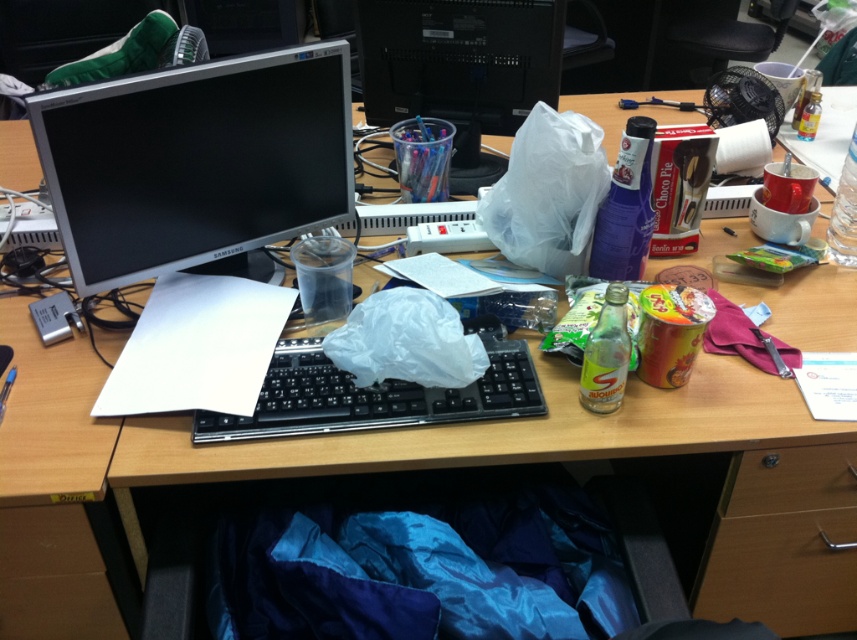
Consider the image. You are trying to place a tall plant next to the satin silver monitor at upper left and the transparent plastic cup at upper center. Which object should you place it next to if you want the plant to be taller than both?

You should place the tall plant next to the satin silver monitor at upper left because it is taller than the transparent plastic cup at upper center, so the plant can be positioned to be taller than both objects.

Looking at this image, you are organizing the desk and need to place a new item at the coordinates mentioned. Where exactly should you position the transparent plastic cup at upper center relative to the other items?

The transparent plastic cup at upper center should be positioned at the coordinates point (460,68) as specified in the description.

You are a delivery robot standing at the camera position. You need to place a package in the wooden drawer at lower center. Can you reach it without moving your position?

The wooden drawer at lower center is 3.53 feet away from the camera, so the delivery robot can reach it without moving as it is within a reasonable distance.